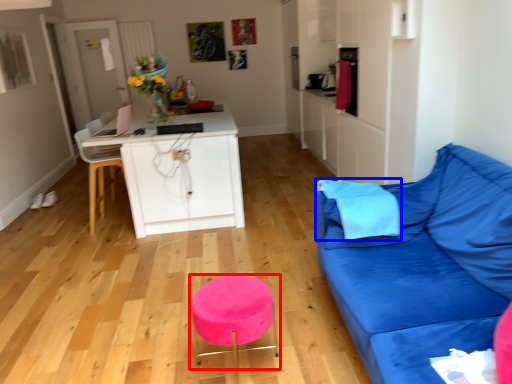
Question: Among these objects, which one is farthest to the camera, bar stool (highlighted by a red box) or pillow (highlighted by a blue box)?

Choices:
 (A) bar stool
 (B) pillow

Answer: (B)